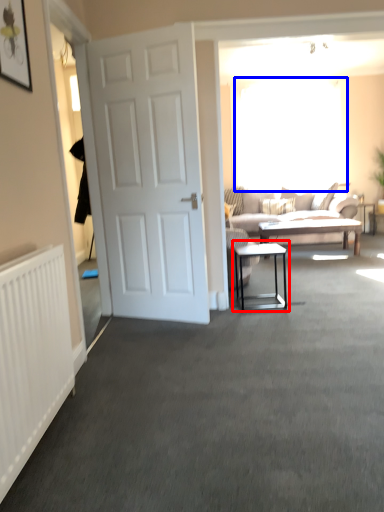
Question: Which object appears closest to the camera in this image, table (highlighted by a red box) or window screen (highlighted by a blue box)?

Choices:
 (A) table
 (B) window screen

Answer: (A)